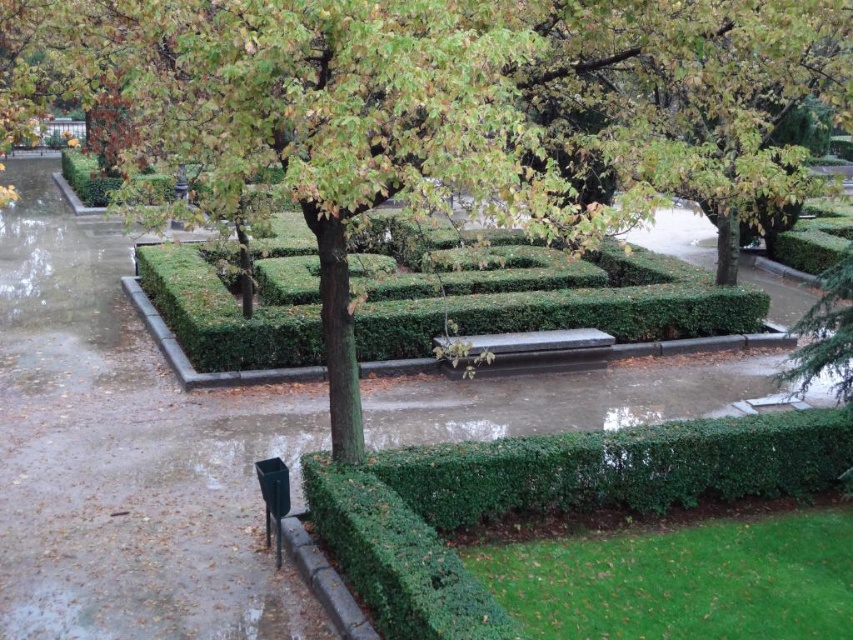
Image resolution: width=853 pixels, height=640 pixels. What are the coordinates of `green leafy hedge at lower right` in the screenshot? It's located at (543, 500).

What do you see at coordinates (543, 500) in the screenshot? I see `green leafy hedge at lower right` at bounding box center [543, 500].

Locate an element on the screen. Image resolution: width=853 pixels, height=640 pixels. green leafy hedge at lower right is located at coordinates (543, 500).

In the scene shown: Who is lower down, green leafy tree at center or smooth dark brown bench at center?

smooth dark brown bench at center

Is green leafy tree at center further to the viewer compared to smooth dark brown bench at center?

No.

Is point (680, 148) farther from viewer compared to point (608, 342)?

No, (680, 148) is closer to viewer.

You are a GUI agent. You are given a task and a screenshot of the screen. Output one action in this format:
    pyautogui.click(x=<x>, y=<y>)
    Task: Click on the green leafy tree at center
    The height and width of the screenshot is (640, 853).
    Given the screenshot: What is the action you would take?
    pyautogui.click(x=445, y=108)

Does green leafy hedge at lower right have a larger size compared to green leafy hedge at center?

Actually, green leafy hedge at lower right might be smaller than green leafy hedge at center.

I want to click on green leafy hedge at lower right, so click(543, 500).